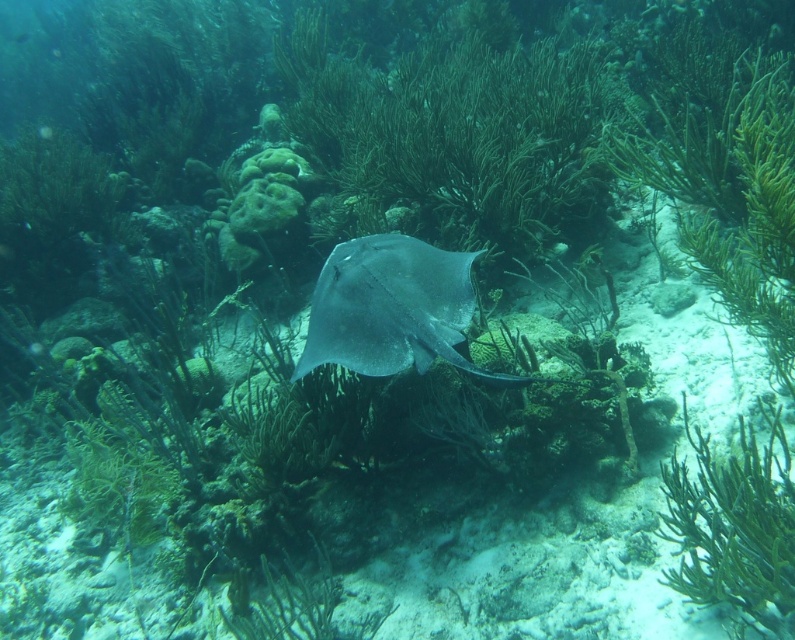
You are a marine biologist observing an underwater scene. You notice a green soft coral at center and a smooth gray stingray at center. Which object is taller in this environment?

The green soft coral at center is taller than the smooth gray stingray at center.

You are a scuba diver swimming in the coral reef and see the green matte algae at center and the green soft coral at center. Which one is closer to you?

The green matte algae at center is closer to you because it is positioned further to the viewer than the green soft coral at center.

Consider the image. You are a scuba diver who wants to place a marker at the point closer to you between point (x=472, y=182) and point (x=754, y=508). Which point should you choose?

Point (x=472, y=182) is closer to you than point (x=754, y=508), so you should choose point (x=472, y=182).